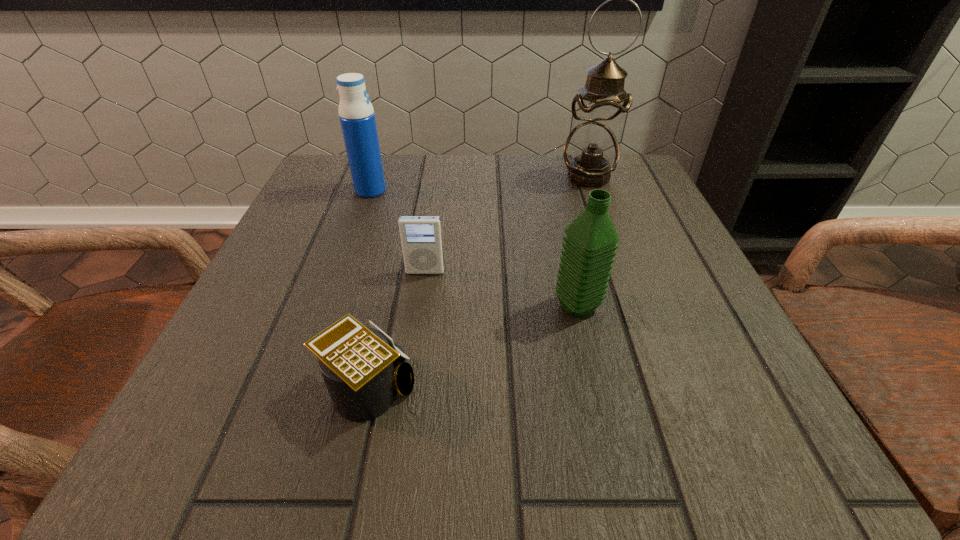
Where is `empty space between the left water bottle and the nearer water bottle`? The height and width of the screenshot is (540, 960). empty space between the left water bottle and the nearer water bottle is located at coordinates (474, 248).

Identify the location of vacant space that's between the iPod and the tallest object. The width and height of the screenshot is (960, 540). (507, 225).

Identify the location of empty space between the left water bottle and the third farthest object. (397, 231).

You are a GUI agent. You are given a task and a screenshot of the screen. Output one action in this format:
    pyautogui.click(x=<x>, y=<y>)
    Task: Click on the vacant point located between the oil lamp and the second shortest object
    This screenshot has height=540, width=960.
    Given the screenshot: What is the action you would take?
    507,225

The width and height of the screenshot is (960, 540). What are the coordinates of `object that is the fourth nearest to the nearer water bottle` in the screenshot? It's located at (356, 113).

Point out which object is positioned as the fourth nearest to the nearer water bottle. Please provide its 2D coordinates. Your answer should be formatted as a tuple, i.e. [(x, y)], where the tuple contains the x and y coordinates of a point satisfying the conditions above.

[(356, 113)]

Identify the location of blank area in the image that satisfies the following two spatial constraints: 1. on the back side of the farther water bottle; 2. on the right side of the oil lamp. The height and width of the screenshot is (540, 960). 375,177.

I want to click on free space that satisfies the following two spatial constraints: 1. on the front-facing side of the third nearest object; 2. on the right side of the third tallest object, so click(x=420, y=306).

Where is `vacant space that satisfies the following two spatial constraints: 1. on the front-facing side of the third nearest object; 2. on the left side of the right water bottle`? vacant space that satisfies the following two spatial constraints: 1. on the front-facing side of the third nearest object; 2. on the left side of the right water bottle is located at coordinates (420, 306).